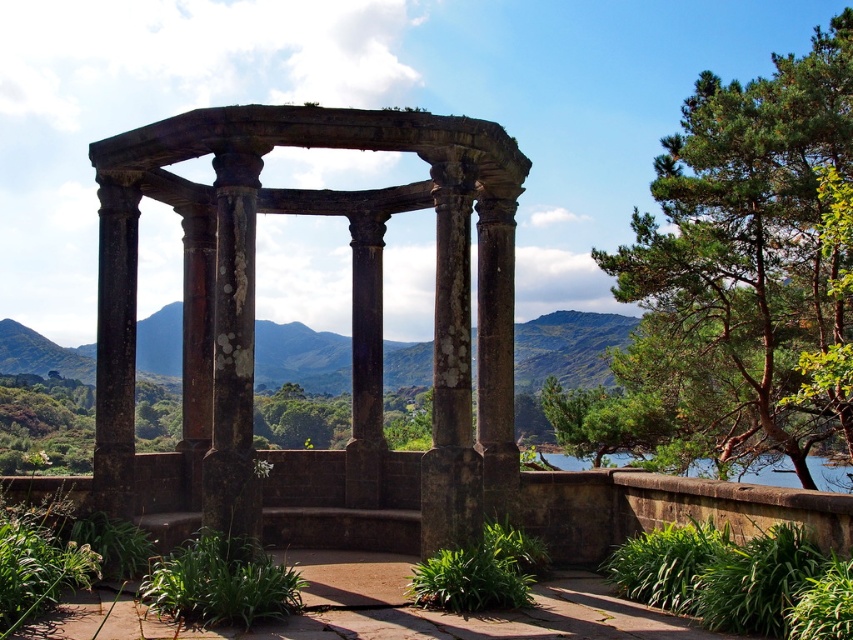
Question: Can you confirm if dark brown stone gazebo at center is positioned to the right of blue stone lake at lower right?

Choices:
 (A) yes
 (B) no

Answer: (B)

Question: Which object is closer to the camera taking this photo?

Choices:
 (A) dark brown stone gazebo at center
 (B) blue stone lake at lower right

Answer: (A)

Question: Can you confirm if dark brown stone gazebo at center is thinner than green textured tree at upper right?

Choices:
 (A) yes
 (B) no

Answer: (A)

Question: Which point appears farthest from the camera in this image?

Choices:
 (A) (824, 476)
 (B) (392, 144)

Answer: (A)

Question: Is green textured tree at upper right behind blue stone lake at lower right?

Choices:
 (A) yes
 (B) no

Answer: (B)

Question: Which point appears closest to the camera in this image?

Choices:
 (A) (758, 476)
 (B) (819, 410)
 (C) (448, 515)

Answer: (C)